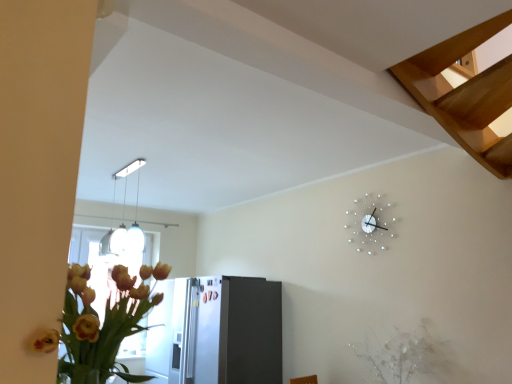
Question: From the image's perspective, does white textured plant at lower right appear higher than white metallic clock at upper right?

Choices:
 (A) yes
 (B) no

Answer: (B)

Question: From a real-world perspective, is white textured plant at lower right beneath white metallic clock at upper right?

Choices:
 (A) no
 (B) yes

Answer: (B)

Question: Is there a large distance between white textured plant at lower right and white metallic clock at upper right?

Choices:
 (A) no
 (B) yes

Answer: (A)

Question: Does white textured plant at lower right have a lesser height compared to white metallic clock at upper right?

Choices:
 (A) yes
 (B) no

Answer: (A)

Question: Is white textured plant at lower right to the left of white metallic clock at upper right from the viewer's perspective?

Choices:
 (A) no
 (B) yes

Answer: (A)

Question: From a real-world perspective, is light brown wooden stairs at upper right above or below white textured plant at lower right?

Choices:
 (A) above
 (B) below

Answer: (A)

Question: Based on their positions, is light brown wooden stairs at upper right located to the left or right of white textured plant at lower right?

Choices:
 (A) right
 (B) left

Answer: (A)

Question: Is light brown wooden stairs at upper right in front of or behind white textured plant at lower right in the image?

Choices:
 (A) front
 (B) behind

Answer: (A)

Question: Choose the correct answer: Is light brown wooden stairs at upper right inside white textured plant at lower right or outside it?

Choices:
 (A) outside
 (B) inside

Answer: (A)

Question: Is white metallic clock at upper right taller or shorter than light brown wooden stairs at upper right?

Choices:
 (A) short
 (B) tall

Answer: (B)

Question: From a real-world perspective, relative to light brown wooden stairs at upper right, is white metallic clock at upper right vertically above or below?

Choices:
 (A) above
 (B) below

Answer: (B)

Question: Considering the positions of white metallic clock at upper right and light brown wooden stairs at upper right in the image, is white metallic clock at upper right bigger or smaller than light brown wooden stairs at upper right?

Choices:
 (A) small
 (B) big

Answer: (A)

Question: Considering the positions of point (371, 246) and point (471, 110), is point (371, 246) closer or farther from the camera than point (471, 110)?

Choices:
 (A) closer
 (B) farther

Answer: (B)

Question: Based on their sizes in the image, would you say satin silver refrigerator at lower center is bigger or smaller than white glossy pendant light at upper center?

Choices:
 (A) big
 (B) small

Answer: (A)

Question: From a real-world perspective, is satin silver refrigerator at lower center physically located above or below white glossy pendant light at upper center?

Choices:
 (A) above
 (B) below

Answer: (B)